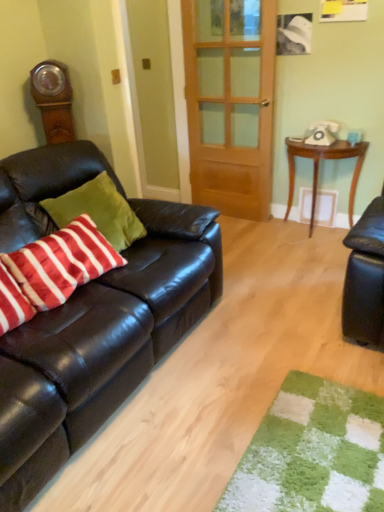
I want to click on free area in between wooden table at right and matte black couch at left, so click(x=252, y=289).